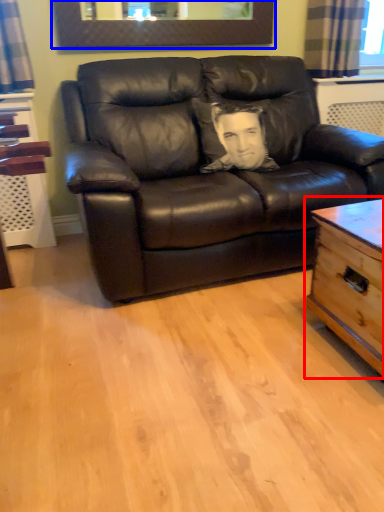
Question: Which of the following is the farthest to the observer, table (highlighted by a red box) or picture frame (highlighted by a blue box)?

Choices:
 (A) table
 (B) picture frame

Answer: (B)